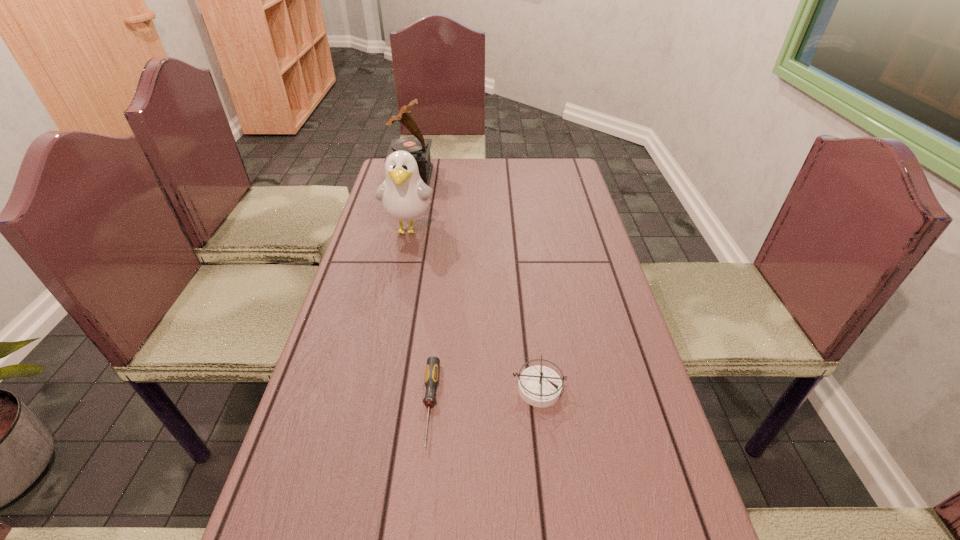
Where is `unoccupied position between the gull and the rightmost object`? The image size is (960, 540). unoccupied position between the gull and the rightmost object is located at coordinates (473, 309).

Locate an element on the screen. free area in between the second object from right to left and the gull is located at coordinates (420, 316).

Locate an element on the screen. free space that is in between the gull and the shortest object is located at coordinates (420, 316).

Find the location of a particular element. The height and width of the screenshot is (540, 960). free space between the compass and the second farthest object is located at coordinates (473, 309).

Select which object is the second closest to the phonograph_record. Please provide its 2D coordinates. Your answer should be formatted as a tuple, i.e. [(x, y)], where the tuple contains the x and y coordinates of a point satisfying the conditions above.

[(433, 363)]

Identify which object is located as the nearest to the second object from right to left. Please provide its 2D coordinates. Your answer should be formatted as a tuple, i.e. [(x, y)], where the tuple contains the x and y coordinates of a point satisfying the conditions above.

[(540, 386)]

You are a GUI agent. You are given a task and a screenshot of the screen. Output one action in this format:
    pyautogui.click(x=<x>, y=<y>)
    Task: Click on the free location that satisfies the following two spatial constraints: 1. at the horn opening of the compass; 2. on the left side of the phonograph_record
    The height and width of the screenshot is (540, 960).
    Given the screenshot: What is the action you would take?
    pyautogui.click(x=361, y=389)

Where is `vacant point that satisfies the following two spatial constraints: 1. on the beak of the second farthest object; 2. on the right side of the compass`? The image size is (960, 540). vacant point that satisfies the following two spatial constraints: 1. on the beak of the second farthest object; 2. on the right side of the compass is located at coordinates (375, 389).

Find the location of a particular element. free space that satisfies the following two spatial constraints: 1. on the beak of the second farthest object; 2. on the left side of the compass is located at coordinates (375, 389).

The width and height of the screenshot is (960, 540). Identify the location of free space that satisfies the following two spatial constraints: 1. at the horn opening of the third tallest object; 2. on the right side of the phonograph_record. pos(361,389).